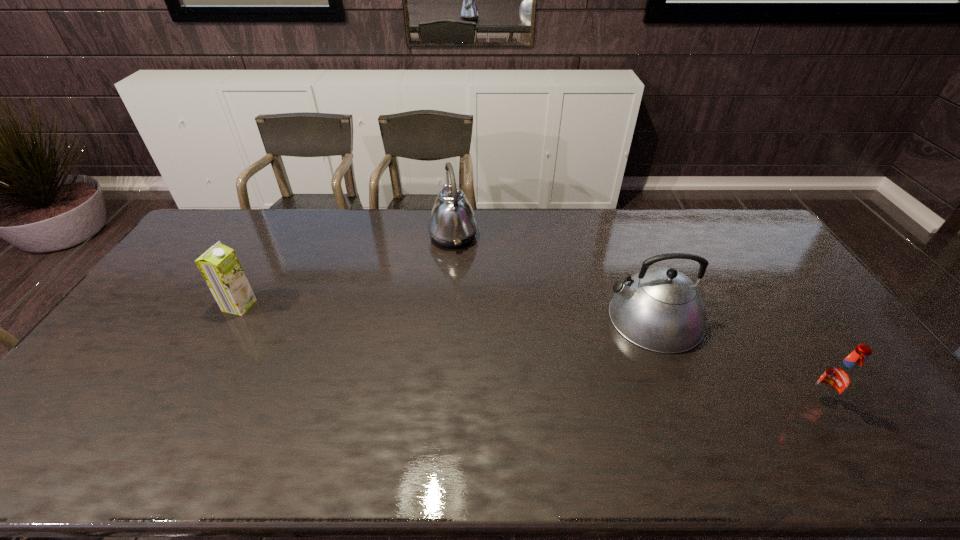
Image resolution: width=960 pixels, height=540 pixels. I want to click on the farthest object, so click(x=452, y=223).

Find the location of a particular element. the farther kettle is located at coordinates (452, 223).

The height and width of the screenshot is (540, 960). I want to click on the right kettle, so [x=659, y=309].

Identify the location of the nearer kettle. The width and height of the screenshot is (960, 540). (659, 309).

Where is `soya milk`? The width and height of the screenshot is (960, 540). soya milk is located at coordinates (219, 265).

At what (x,y) coordinates should I click in order to perform the action: click on root beer. Please return your answer as a coordinate pair (x, y). This screenshot has height=540, width=960. Looking at the image, I should click on (838, 379).

Image resolution: width=960 pixels, height=540 pixels. Identify the location of the nearest object. point(838,379).

I want to click on free space located 0.060m on the front of the second object from left to right, so click(451, 266).

What are the coordinates of `vacant space situated from the spout of the shorter kettle` in the screenshot? It's located at (485, 318).

The width and height of the screenshot is (960, 540). What are the coordinates of `free space located 0.360m from the spout of the shorter kettle` in the screenshot? It's located at (485, 318).